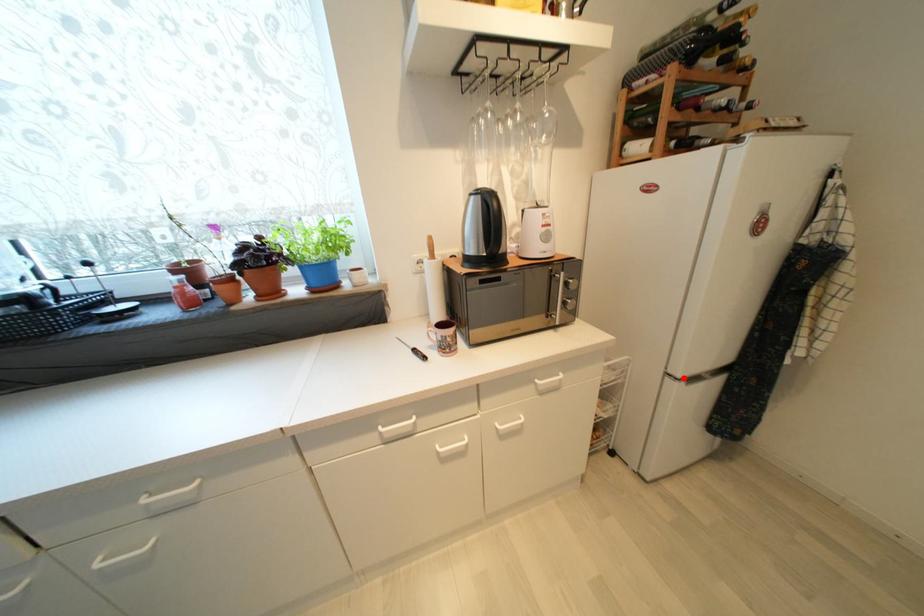
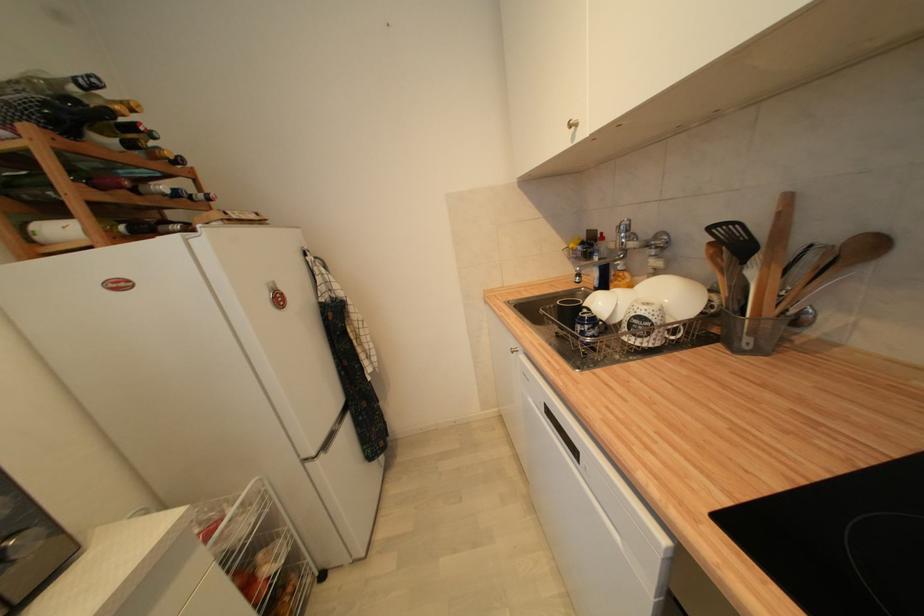
Find the pixel in the second image that matches the highlighted location in the first image.

(319, 456)